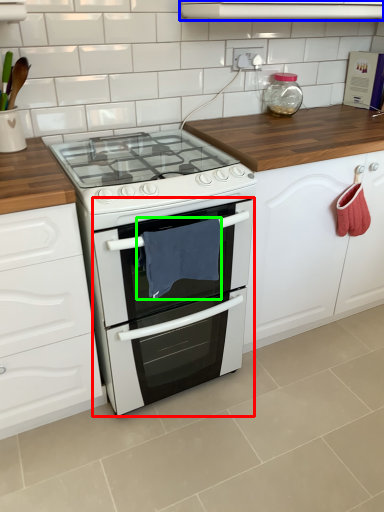
Question: Which is farther away from oven (highlighted by a red box)? vent (highlighted by a blue box) or material (highlighted by a green box)?

Choices:
 (A) vent
 (B) material

Answer: (A)